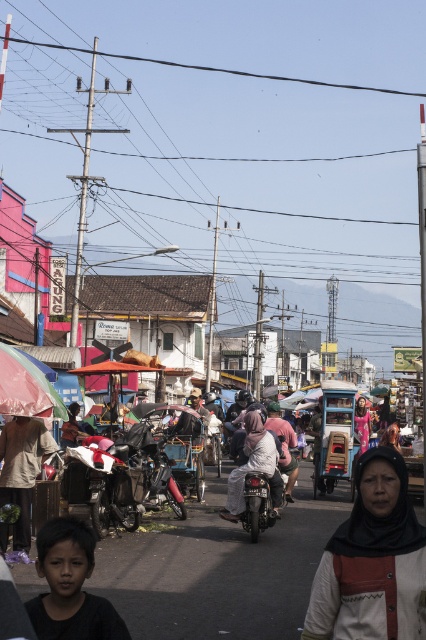
You are standing in the middle of the busy market street scene. There are two points marked in the image. The first point is at coordinates point (83, 636) and the second point is at coordinates point (368, 435). Which point is closer to you?

Point (83, 636) is closer to the viewer than point (368, 435).

In the scene shown: You are standing at the point labeled point (259, 449) and want to walk to the point labeled point (253, 528). According to the scene description, which direction should you move to reach your destination?

Since point (259, 449) is behind point (253, 528), you should move forward towards point (253, 528) to reach your destination.

Looking at this image, you are a photographer standing in the middle of the street. You want to take a photo of the shiny black motorcycle at center and the matte pink dress at center. Which object is closer to the left side of your camera frame?

The shiny black motorcycle at center is positioned on the left side of matte pink dress at center, so it will appear closer to the left side of your camera frame.